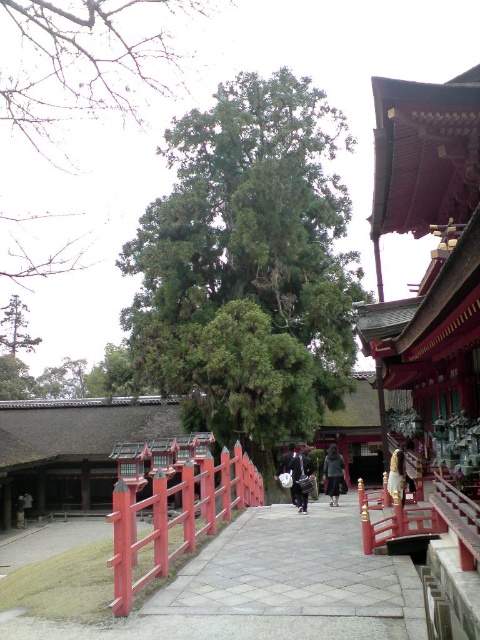
Question: Among these points, which one is farthest from the camera?

Choices:
 (A) (295, 477)
 (B) (326, 582)
 (C) (333, 451)

Answer: (C)

Question: Which of the following is the farthest from the observer?

Choices:
 (A) 132,572
 (B) 308,488
 (C) 269,532

Answer: (B)

Question: Which is farther from the smooth stone path at center?

Choices:
 (A) dark blue fabric bag at center
 (B) dark gray fabric pants at center
 (C) smooth glossy wood at center
 (D) brown leather jacket at center

Answer: (B)

Question: Is smooth stone path at center wider than brown leather jacket at center?

Choices:
 (A) yes
 (B) no

Answer: (B)

Question: Is smooth stone path at center behind brown leather jacket at center?

Choices:
 (A) yes
 (B) no

Answer: (B)

Question: Does smooth stone path at center have a lesser width compared to dark blue fabric bag at center?

Choices:
 (A) yes
 (B) no

Answer: (B)